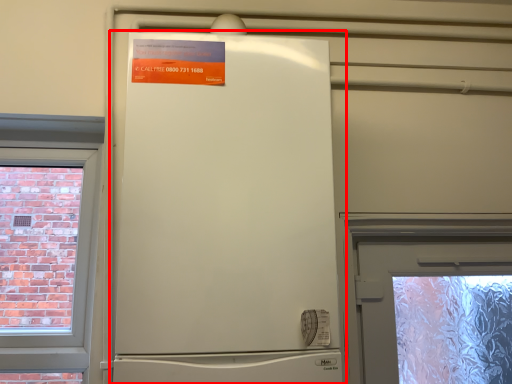
Question: From the image's perspective, what is the correct spatial positioning of refrigerator (annotated by the red box) in reference to poster?

Choices:
 (A) below
 (B) above

Answer: (A)